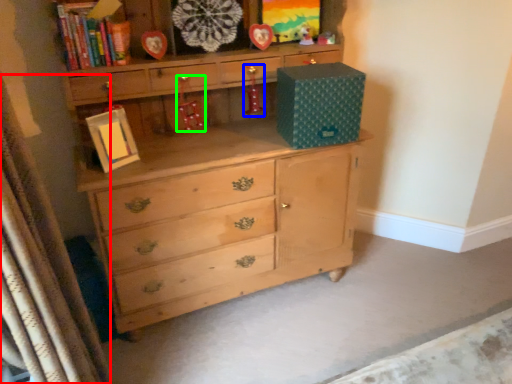
Question: Which is nearer to the curtain (highlighted by a red box)? toy (highlighted by a blue box) or toy (highlighted by a green box).

Choices:
 (A) toy
 (B) toy

Answer: (B)